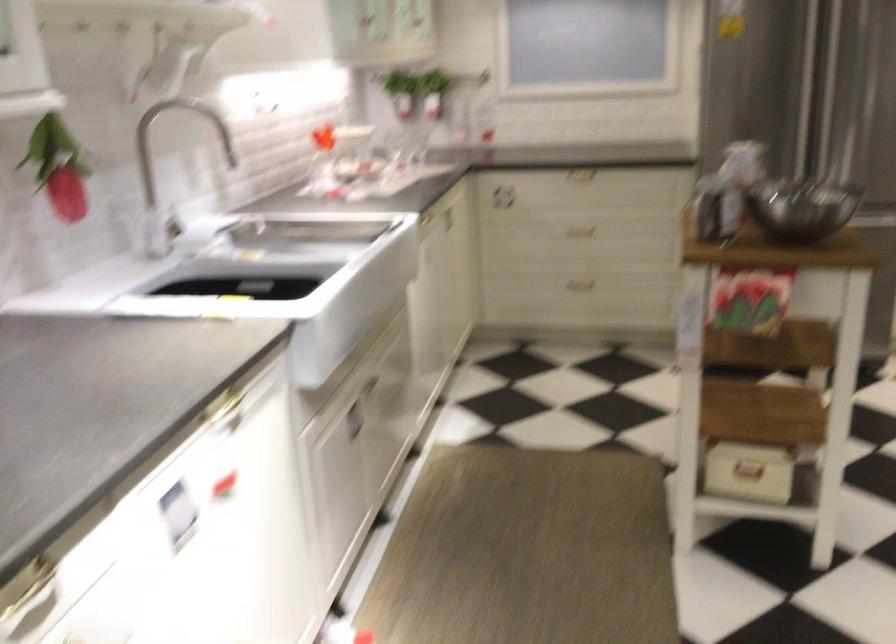
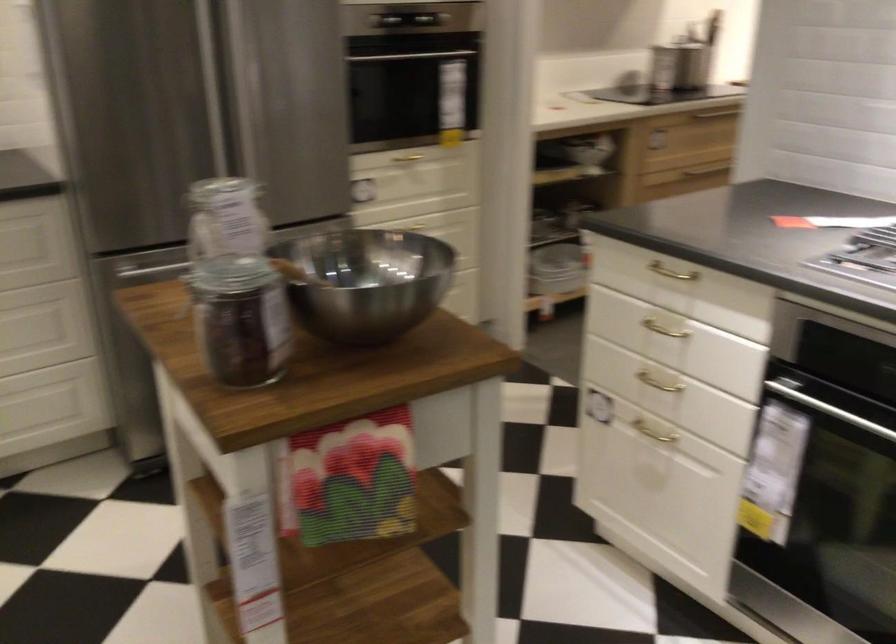
In the second image, find the point that corresponds to (x=813, y=204) in the first image.

(366, 281)